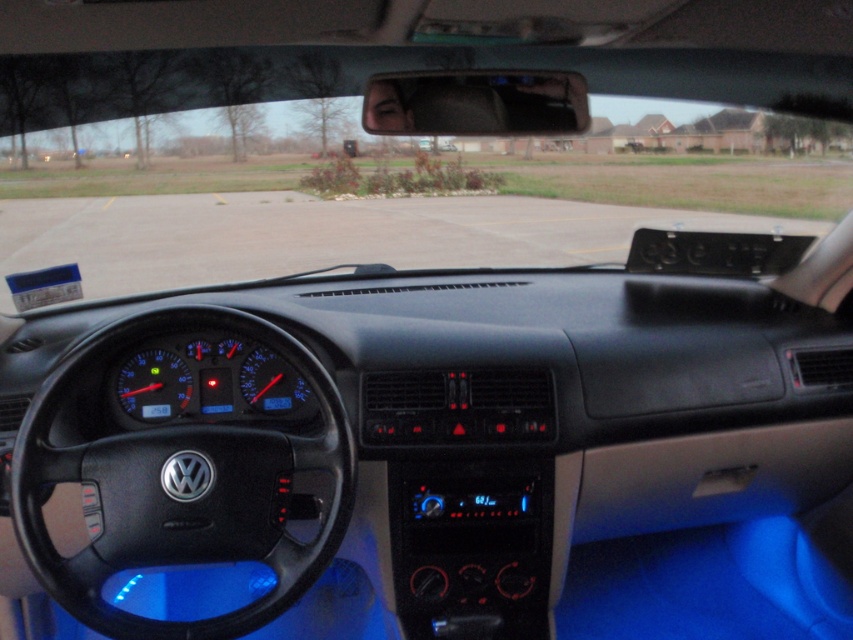
Can you confirm if transparent glass windshield at center is bigger than black leather steering wheel at left?

Correct, transparent glass windshield at center is larger in size than black leather steering wheel at left.

What do you see at coordinates (383, 168) in the screenshot?
I see `transparent glass windshield at center` at bounding box center [383, 168].

Does point (718, 198) lie behind point (80, 577)?

Yes, point (718, 198) is farther from viewer.

Locate an element on the screen. The width and height of the screenshot is (853, 640). transparent glass windshield at center is located at coordinates (383, 168).